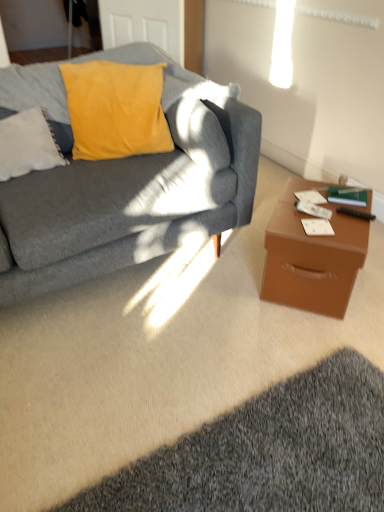
The width and height of the screenshot is (384, 512). What are the coordinates of `vacant space in dark gray shaggy rug at lower right (from a real-world perspective)` in the screenshot? It's located at pyautogui.click(x=274, y=455).